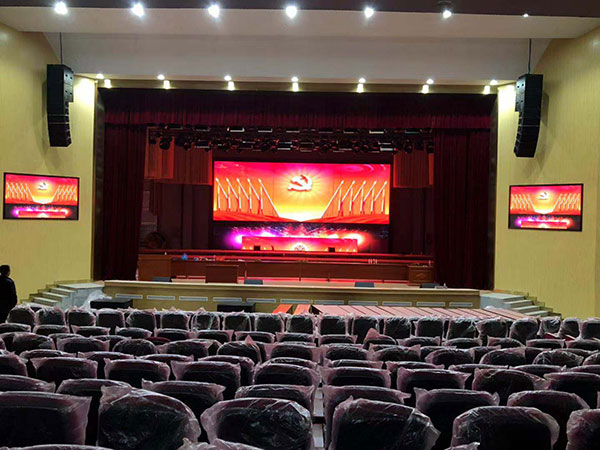
Identify the location of curtain. (129, 157), (454, 191), (168, 213), (396, 223).